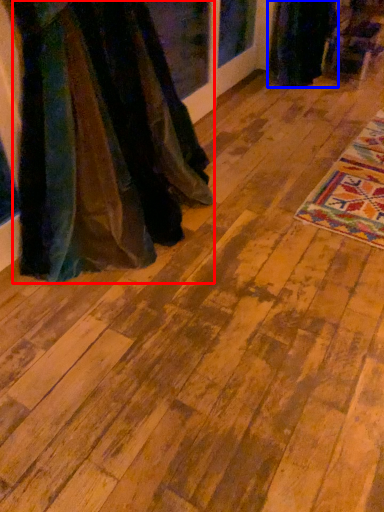
Question: Which point is closer to the camera, fancy dress (highlighted by a red box) or fancy dress (highlighted by a blue box)?

Choices:
 (A) fancy dress
 (B) fancy dress

Answer: (A)